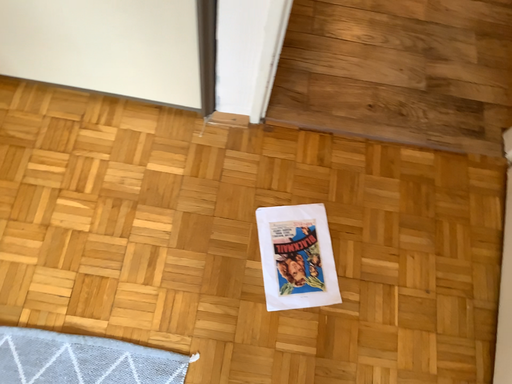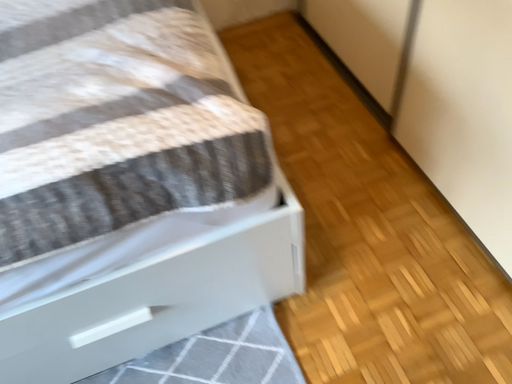
Question: Which way did the camera rotate in the video?

Choices:
 (A) rotated left
 (B) rotated right

Answer: (A)